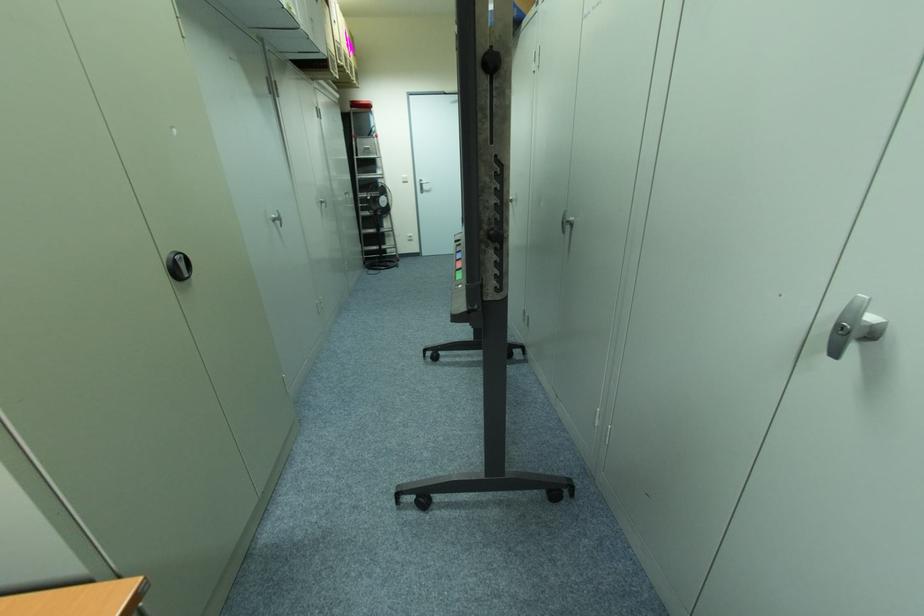
Locate an element on the screen. This screenshot has width=924, height=616. black adjustment knob is located at coordinates (178, 265).